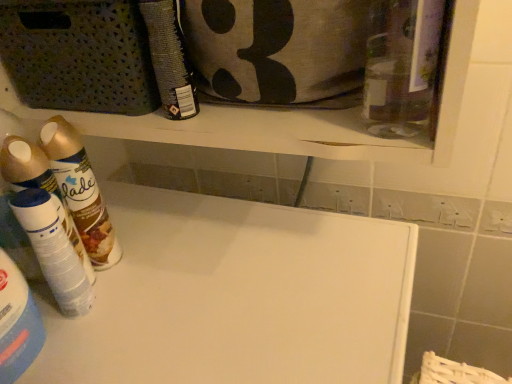
Question: From the image's perspective, would you say white plastic spray can at left, positioned as the second cleaning product in left-to-right order, is shown under matte black spray can at upper center, acting as the 3th cleaning product starting from the left?

Choices:
 (A) yes
 (B) no

Answer: (A)

Question: Can you confirm if white plastic spray can at left, positioned as the second cleaning product in left-to-right order, is taller than matte black spray can at upper center, the first cleaning product viewed from the right?

Choices:
 (A) no
 (B) yes

Answer: (B)

Question: Does white plastic spray can at left, positioned as the second cleaning product in right-to-left order, have a smaller size compared to matte black spray can at upper center, the first cleaning product viewed from the right?

Choices:
 (A) yes
 (B) no

Answer: (B)

Question: Considering the relative positions of white plastic spray can at left, positioned as the second cleaning product in right-to-left order, and matte black spray can at upper center, acting as the 3th cleaning product starting from the left, in the image provided, is white plastic spray can at left, positioned as the second cleaning product in right-to-left order, to the left of matte black spray can at upper center, acting as the 3th cleaning product starting from the left, from the viewer's perspective?

Choices:
 (A) no
 (B) yes

Answer: (B)

Question: From a real-world perspective, does white plastic spray can at left, positioned as the second cleaning product in right-to-left order, stand above matte black spray can at upper center, the first cleaning product viewed from the right?

Choices:
 (A) no
 (B) yes

Answer: (A)

Question: Is white plastic spray can at left, positioned as the second cleaning product in right-to-left order, bigger than matte black spray can at upper center, acting as the 3th cleaning product starting from the left?

Choices:
 (A) no
 (B) yes

Answer: (B)

Question: Is white matte board at center beside white plastic spray can at left, positioned as the second cleaning product in right-to-left order?

Choices:
 (A) yes
 (B) no

Answer: (B)

Question: From the image's perspective, is white matte board at center on white plastic spray can at left, positioned as the second cleaning product in right-to-left order?

Choices:
 (A) no
 (B) yes

Answer: (A)

Question: Considering the relative positions of white matte board at center and white plastic spray can at left, positioned as the second cleaning product in right-to-left order, in the image provided, is white matte board at center in front of white plastic spray can at left, positioned as the second cleaning product in right-to-left order,?

Choices:
 (A) no
 (B) yes

Answer: (B)

Question: From a real-world perspective, is white matte board at center positioned under white plastic spray can at left, positioned as the second cleaning product in left-to-right order, based on gravity?

Choices:
 (A) yes
 (B) no

Answer: (A)

Question: Is white plastic spray can at left, positioned as the second cleaning product in left-to-right order, inside white matte board at center?

Choices:
 (A) yes
 (B) no

Answer: (B)

Question: Can you confirm if white matte board at center is positioned to the left of white plastic spray can at left, positioned as the second cleaning product in left-to-right order?

Choices:
 (A) no
 (B) yes

Answer: (A)

Question: Is there a large distance between textured gray fabric pouch at upper center and gold metallic spray can at left, the first cleaning product in the left-to-right sequence?

Choices:
 (A) no
 (B) yes

Answer: (A)